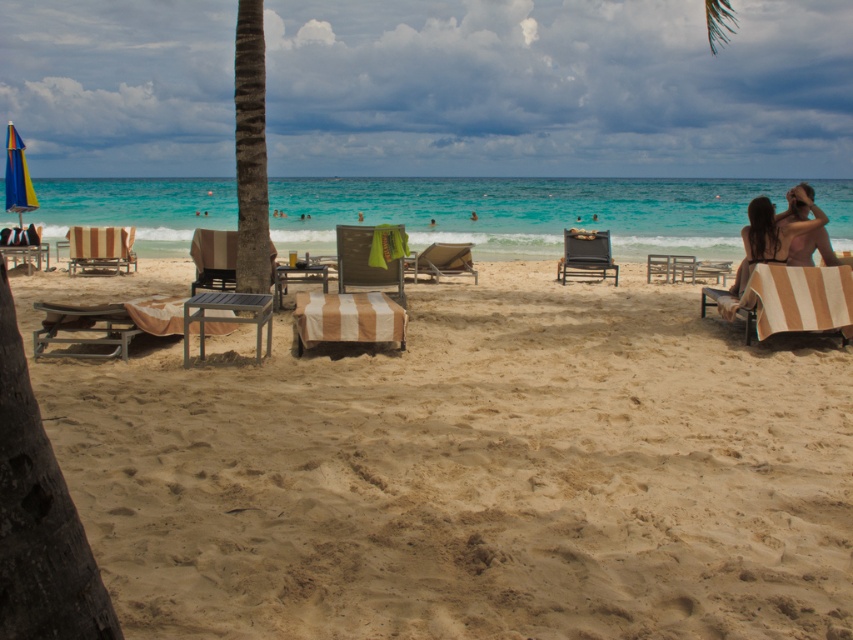
Between beige striped lounge chair at right and beige striped beach chair at left, which one has more height?

With more height is beige striped lounge chair at right.

Who is more distant from viewer, (791, 250) or (80, 250)?

The point (80, 250) is behind.

The height and width of the screenshot is (640, 853). I want to click on beige striped lounge chair at right, so click(781, 234).

Is point (216, 273) closer to viewer compared to point (77, 243)?

Yes, it is.

Is wooden slatted beach chair at center to the right of beige striped beach chair at left from the viewer's perspective?

Indeed, wooden slatted beach chair at center is positioned on the right side of beige striped beach chair at left.

Consider the image. Who is more distant from viewer, (218, 243) or (125, 246)?

The point (125, 246) is more distant.

Where is `wooden slatted beach chair at center`? The width and height of the screenshot is (853, 640). wooden slatted beach chair at center is located at coordinates (213, 259).

Is beige striped beach chair at left below beige striped beach chair at center?

No, beige striped beach chair at left is not below beige striped beach chair at center.

Does beige striped beach chair at left have a greater width compared to beige striped beach chair at center?

Yes.

Find the location of a particular element. This screenshot has width=853, height=640. beige striped beach chair at left is located at coordinates (100, 248).